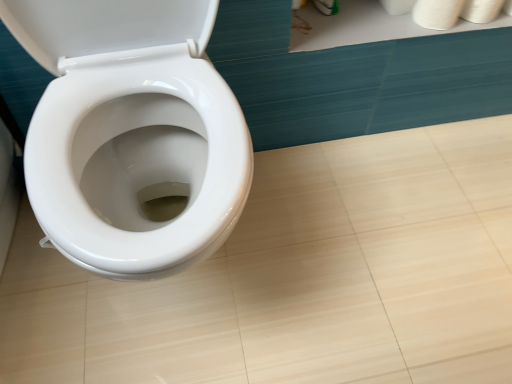
Question: From their relative heights in the image, would you say white matte toilet paper at upper right, the third toilet paper viewed from the right, is taller or shorter than white matte toilet paper at upper right, the 3th toilet paper positioned from the left?

Choices:
 (A) short
 (B) tall

Answer: (A)

Question: Do you think white matte toilet paper at upper right, the 1th toilet paper when ordered from left to right, is within white matte toilet paper at upper right, acting as the 1th toilet paper starting from the right, or outside of it?

Choices:
 (A) outside
 (B) inside

Answer: (A)

Question: Which of these objects is positioned closest to the white matte toilet paper at upper right, the third toilet paper viewed from the right?

Choices:
 (A) white matte toilet paper at upper right, marked as the second toilet paper in a right-to-left arrangement
 (B) white matte toilet paper at upper right, the 3th toilet paper positioned from the left

Answer: (A)

Question: Considering the real-world distances, which object is closest to the white matte toilet paper at upper right, the 2th toilet paper viewed from the left?

Choices:
 (A) white matte toilet paper at upper right, the third toilet paper viewed from the right
 (B) white matte toilet paper at upper right, the 3th toilet paper positioned from the left

Answer: (B)